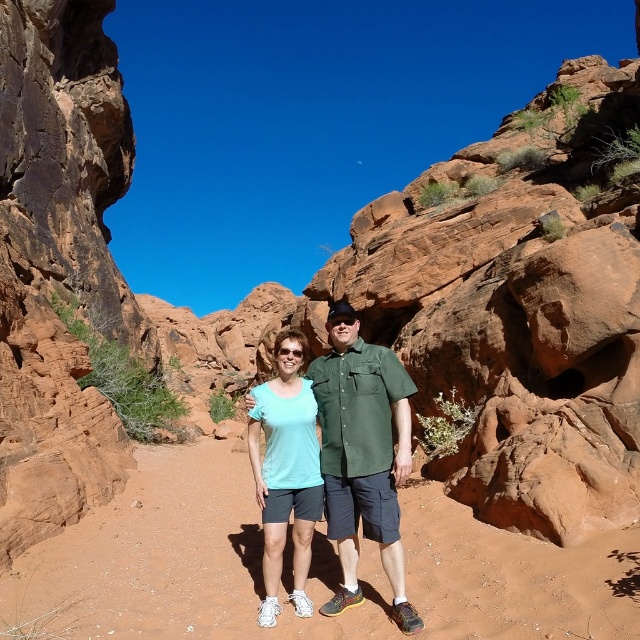
Question: Is sandy soil at center to the right of matte green shirt at center from the viewer's perspective?

Choices:
 (A) yes
 (B) no

Answer: (B)

Question: Which object is positioned closest to the matte teal shirt at center?

Choices:
 (A) rustic sandstone rock at left
 (B) matte green shirt at center

Answer: (B)

Question: Does sandy soil at center appear under matte teal shirt at center?

Choices:
 (A) yes
 (B) no

Answer: (A)

Question: Which object is closer to the camera taking this photo?

Choices:
 (A) sandy soil at center
 (B) matte green shirt at center

Answer: (A)

Question: Does sandy soil at center appear over rustic sandstone rock at left?

Choices:
 (A) no
 (B) yes

Answer: (A)

Question: Among these points, which one is nearest to the camera?

Choices:
 (A) (314, 449)
 (B) (385, 570)
 (C) (116, 120)

Answer: (B)